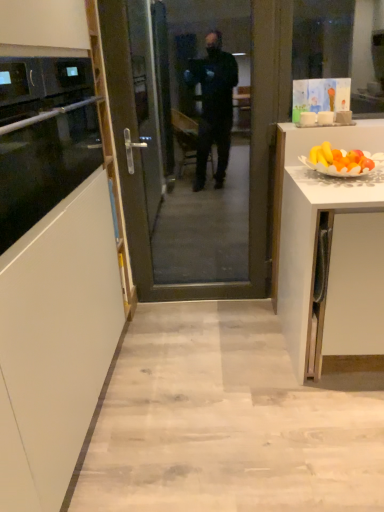
Image resolution: width=384 pixels, height=512 pixels. What do you see at coordinates (44, 137) in the screenshot?
I see `black glass oven at left` at bounding box center [44, 137].

I want to click on black glass oven at left, so click(44, 137).

Locate an element on the screen. The width and height of the screenshot is (384, 512). transparent glass door at center is located at coordinates (196, 138).

The width and height of the screenshot is (384, 512). What do you see at coordinates (196, 138) in the screenshot?
I see `transparent glass door at center` at bounding box center [196, 138].

Locate an element on the screen. Image resolution: width=384 pixels, height=512 pixels. black glass oven at left is located at coordinates (44, 137).

Between black glass oven at left and transparent glass door at center, which one appears on the right side from the viewer's perspective?

From the viewer's perspective, transparent glass door at center appears more on the right side.

Is black glass oven at left positioned behind transparent glass door at center?

No, the depth of black glass oven at left is less than that of transparent glass door at center.

Considering the positions of point (64, 132) and point (110, 103), is point (64, 132) closer or farther from the camera than point (110, 103)?

Point (64, 132) is closer to the camera than point (110, 103).

From the image's perspective, which one is positioned higher, black glass oven at left or transparent glass door at center?

black glass oven at left, from the image's perspective.

From a real-world perspective, which is physically below, black glass oven at left or transparent glass door at center?

transparent glass door at center, from a real-world perspective.

Looking at their sizes, would you say black glass oven at left is wider or thinner than transparent glass door at center?

Clearly, black glass oven at left has more width compared to transparent glass door at center.

In the scene shown: Is black glass oven at left shorter than transparent glass door at center?

Indeed, black glass oven at left has a lesser height compared to transparent glass door at center.

Between black glass oven at left and transparent glass door at center, which one has larger size?

With larger size is transparent glass door at center.

Is black glass oven at left completely or partially outside of transparent glass door at center?

Yes, black glass oven at left is not within transparent glass door at center.

Are black glass oven at left and transparent glass door at center beside each other?

No, black glass oven at left is not in contact with transparent glass door at center.

Looking at this image, is black glass oven at left facing towards transparent glass door at center?

No, black glass oven at left does not turn towards transparent glass door at center.

At what (x,y) coordinates should I click in order to perform the action: click on oven located on the left of transparent glass door at center. Please return your answer as a coordinate pair (x, y). Looking at the image, I should click on (44, 137).

Considering the positions of objects transparent glass door at center and black glass oven at left in the image provided, who is more to the left, transparent glass door at center or black glass oven at left?

black glass oven at left.

Which is in front, transparent glass door at center or black glass oven at left?

black glass oven at left.

Does point (243, 30) come behind point (47, 173)?

That is True.

From the image's perspective, is transparent glass door at center positioned above or below black glass oven at left?

transparent glass door at center is situated lower than black glass oven at left in the image.

From a real-world perspective, who is located lower, transparent glass door at center or black glass oven at left?

transparent glass door at center, from a real-world perspective.

Which object is thinner, transparent glass door at center or black glass oven at left?

With smaller width is transparent glass door at center.

Considering the relative sizes of transparent glass door at center and black glass oven at left in the image provided, is transparent glass door at center shorter than black glass oven at left?

Incorrect, the height of transparent glass door at center does not fall short of that of black glass oven at left.

Is transparent glass door at center bigger than black glass oven at left?

Indeed, transparent glass door at center has a larger size compared to black glass oven at left.

Would you say transparent glass door at center is outside black glass oven at left?

Yes.

In the scene shown: Would you say transparent glass door at center is a long distance from black glass oven at left?

Yes, transparent glass door at center is far from black glass oven at left.

Could you tell me if transparent glass door at center is facing black glass oven at left?

Yes, transparent glass door at center is turned towards black glass oven at left.

I want to click on oven above the transparent glass door at center (from a real-world perspective), so click(44, 137).

You are a GUI agent. You are given a task and a screenshot of the screen. Output one action in this format:
    pyautogui.click(x=<x>, y=<y>)
    Task: Click on the oven that is above the transparent glass door at center (from a real-world perspective)
    This screenshot has width=384, height=512.
    Given the screenshot: What is the action you would take?
    pyautogui.click(x=44, y=137)

Identify the location of screen door below the black glass oven at left (from a real-world perspective). This screenshot has height=512, width=384. (196, 138).